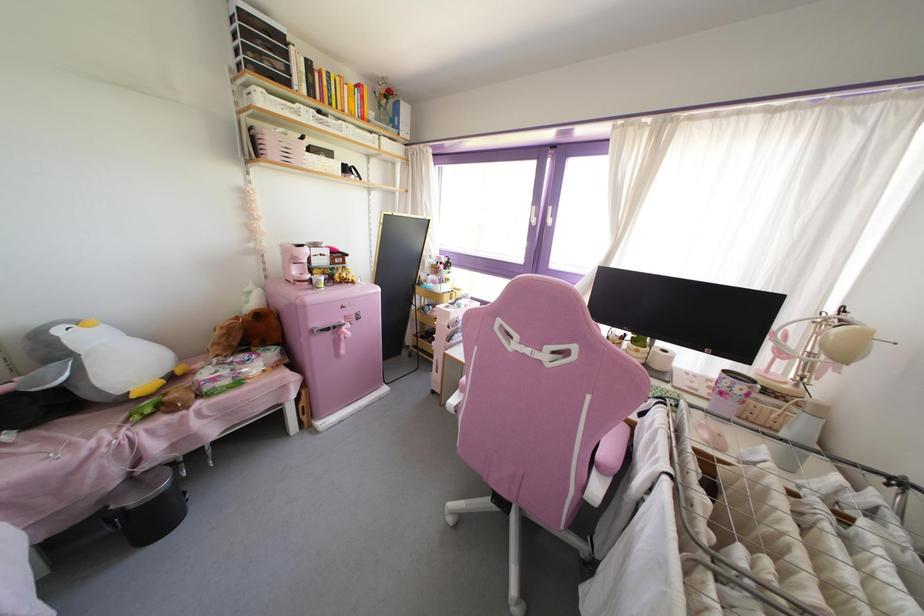
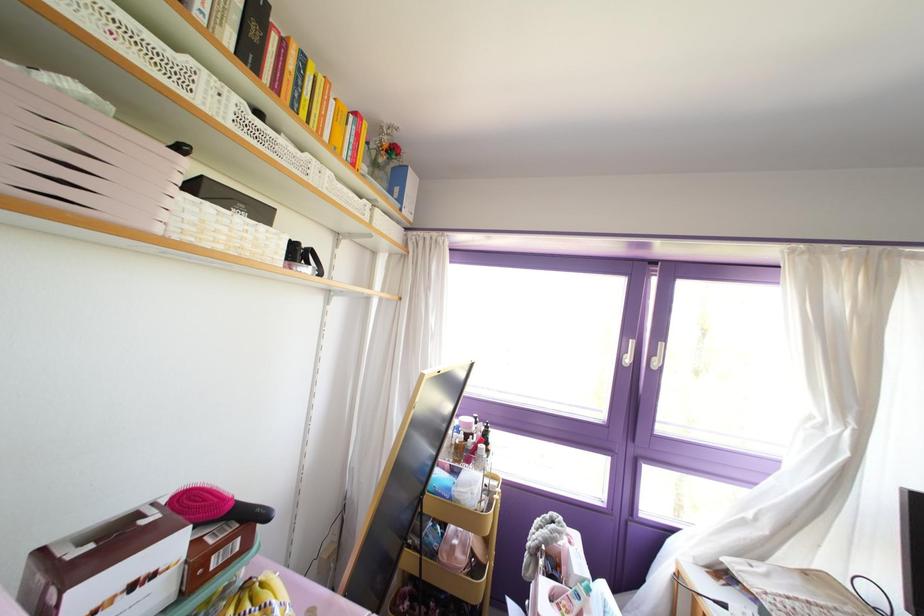
The point at (294, 161) is marked in the first image. Where is the corresponding point in the second image?

(107, 208)